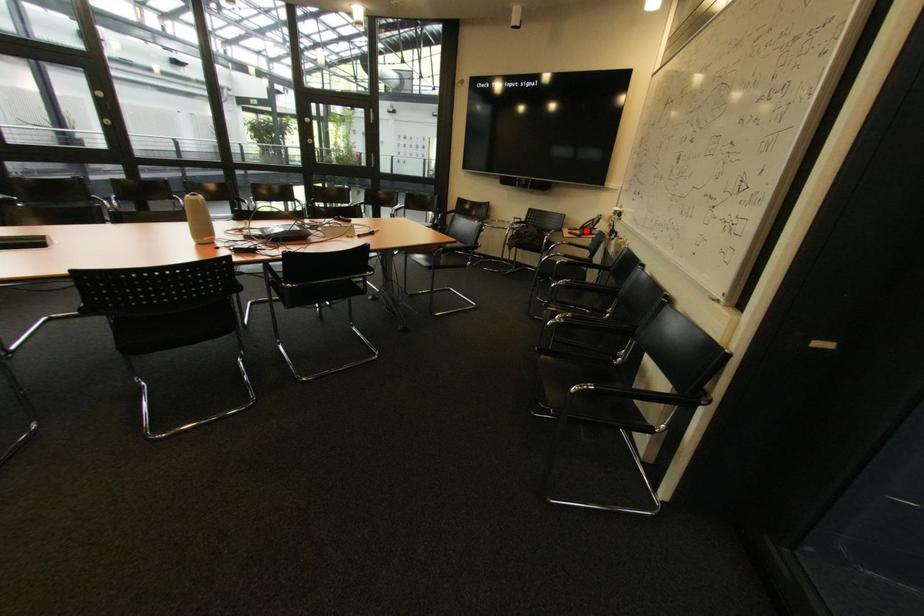
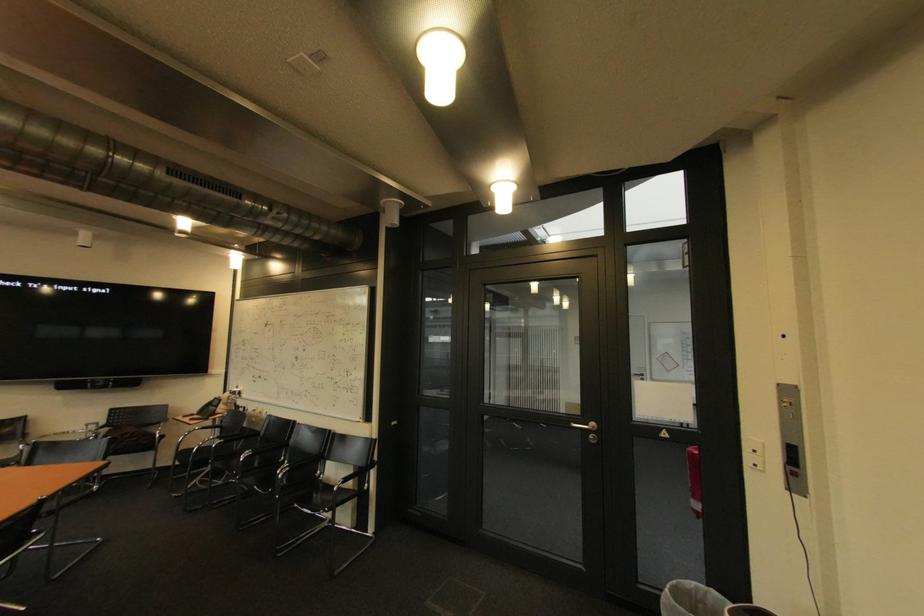
Find the pixel in the second image that matches the highlighted location in the first image.

(204, 416)